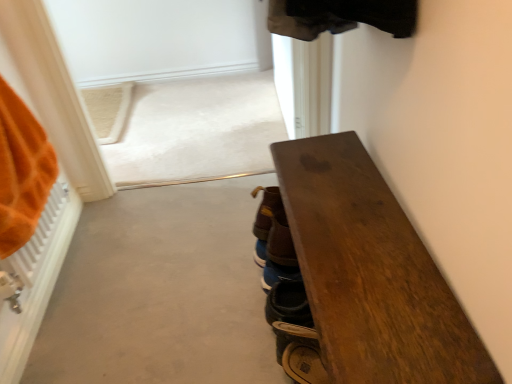
Question: Looking at the image, does dark wood bench at right seem bigger or smaller compared to leather brown shoe at lower center, positioned as the first footwear in front-to-back order?

Choices:
 (A) big
 (B) small

Answer: (A)

Question: Do you think dark wood bench at right is within leather brown shoe at lower center, positioned as the first footwear in front-to-back order, or outside of it?

Choices:
 (A) outside
 (B) inside

Answer: (A)

Question: Which object is positioned farthest from the brown suede shoes at center, the 3th footwear when ordered from front to back?

Choices:
 (A) dark wood bench at right
 (B) brown leather shoes at center, the second footwear viewed from the back
 (C) leather brown shoe at lower center, the third footwear positioned from the back

Answer: (A)

Question: Estimate the real-world distances between objects in this image. Which object is closer to the dark wood bench at right?

Choices:
 (A) brown suede shoes at center, the 3th footwear when ordered from front to back
 (B) leather brown shoe at lower center, the third footwear positioned from the back
 (C) brown leather shoes at center, which is the second footwear in front-to-back order

Answer: (B)